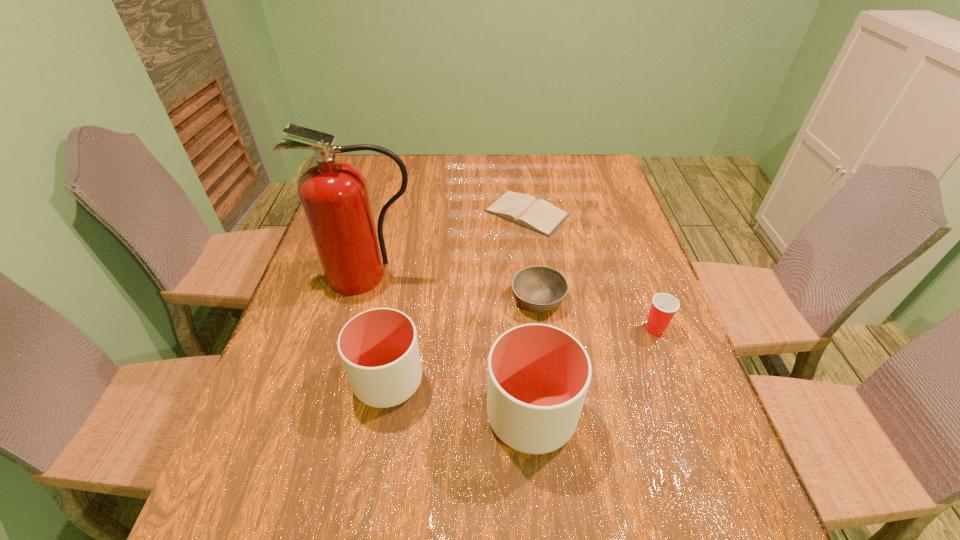
Find the location of a particular element. This screenshot has height=540, width=960. free space between the fifth tallest object and the rightmost object is located at coordinates (596, 314).

Identify the location of unoccupied area between the bowl and the farthest object. point(533,256).

Choose which object is the fourth nearest neighbor to the Bible. Please provide its 2D coordinates. Your answer should be formatted as a tuple, i.e. [(x, y)], where the tuple contains the x and y coordinates of a point satisfying the conditions above.

[(379, 349)]

Choose which object is the nearest neighbor to the Dixie cup. Please provide its 2D coordinates. Your answer should be formatted as a tuple, i.e. [(x, y)], where the tuple contains the x and y coordinates of a point satisfying the conditions above.

[(540, 289)]

Identify the location of vacant point that satisfies the following two spatial constraints: 1. with the handle and nozzle on the fire extinguisher; 2. on the right side of the second shortest object. The height and width of the screenshot is (540, 960). (363, 299).

Where is `free point that satisfies the following two spatial constraints: 1. with the handle and nozzle on the tallest object; 2. on the left side of the bowl`? The width and height of the screenshot is (960, 540). free point that satisfies the following two spatial constraints: 1. with the handle and nozzle on the tallest object; 2. on the left side of the bowl is located at coordinates (363, 299).

At what (x,y) coordinates should I click in order to perform the action: click on blank space that satisfies the following two spatial constraints: 1. with the handle and nozzle on the bowl; 2. on the left side of the tallest object. Please return your answer as a coordinate pair (x, y). Looking at the image, I should click on (363, 299).

Find the location of a particular element. vacant area in the image that satisfies the following two spatial constraints: 1. on the back side of the second shortest object; 2. on the left side of the left cup is located at coordinates (402, 299).